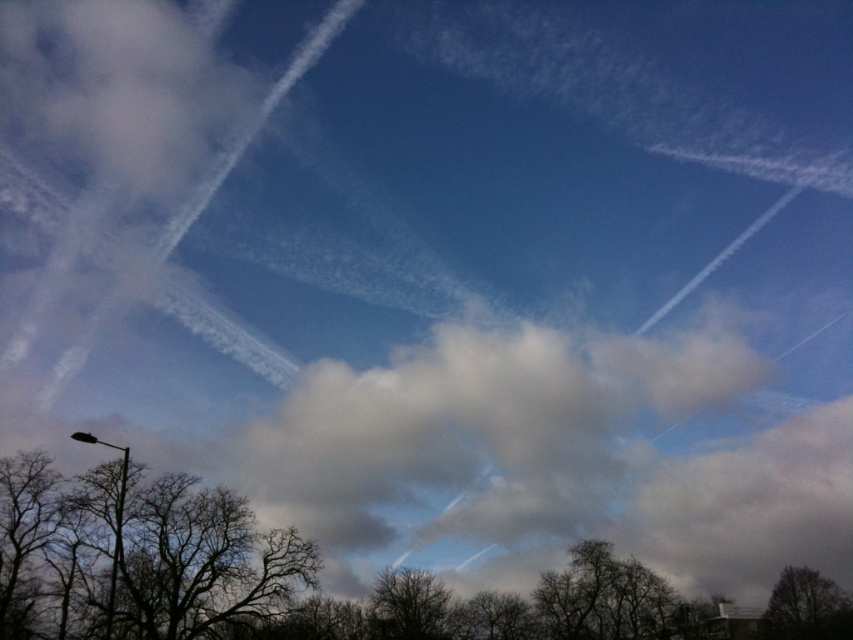
You are a bird looking for a place to perch. You see the dark brown textured tree at lower center and the black metal lamp post at lower left. Which one is smaller and better for your size?

The dark brown textured tree at lower center is smaller compared to the black metal lamp post at lower left, so it would be better for your size.

Consider the image. You are a photographer aiming to capture a closeup of the dark brown textured tree at lower right and the black metal lamp post at lower left. Which object should you move closer to in order to focus on it better?

The dark brown textured tree at lower right is closer to the viewer than the black metal lamp post at lower left, so to focus better on it, you should move closer to the dark brown textured tree at lower right.

You are a photographer planning to capture the entire scene in one shot. Given the dark brown textured tree at lower right and the black metal lamp post at lower left, which object would you need to adjust your camera angle to include fully in the frame?

The black metal lamp post at lower left occupies more space than the dark brown textured tree at lower right, so you would need to adjust your camera angle to include the black metal lamp post at lower left fully in the frame.